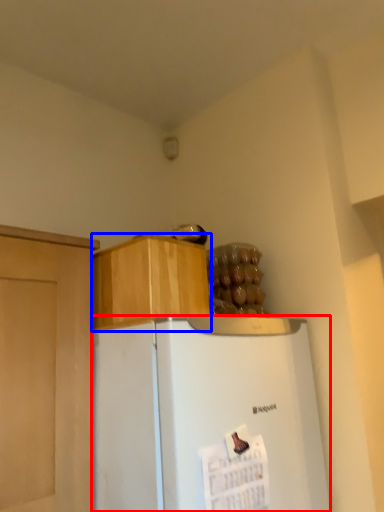
Question: Which object is further to the camera taking this photo, refrigerator (highlighted by a red box) or cabinetry (highlighted by a blue box)?

Choices:
 (A) refrigerator
 (B) cabinetry

Answer: (B)